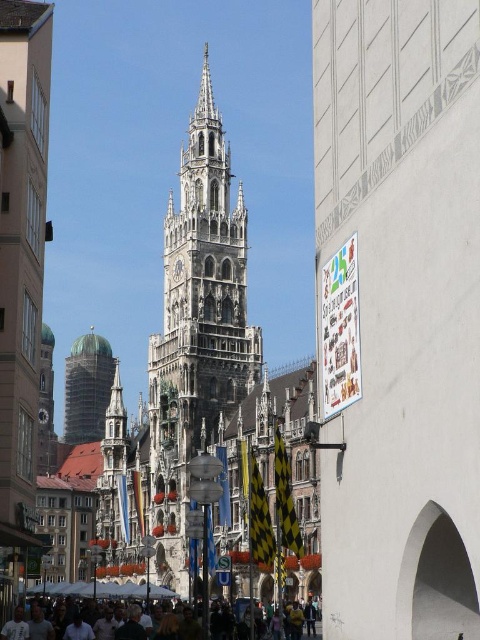
Question: Which is farther from the green copper dome at center?

Choices:
 (A) dark gray concrete crowd at lower center
 (B) stone gothic tower at center

Answer: (A)

Question: Which point is closer to the camera taking this photo?

Choices:
 (A) (72, 348)
 (B) (169, 612)

Answer: (B)

Question: Estimate the real-world distances between objects in this image. Which object is farther from the green copper dome at center?

Choices:
 (A) stone gothic tower at center
 (B) dark gray concrete crowd at lower center

Answer: (B)

Question: Is stone gothic tower at center thinner than dark gray concrete crowd at lower center?

Choices:
 (A) yes
 (B) no

Answer: (A)

Question: From the image, what is the correct spatial relationship of dark gray concrete crowd at lower center in relation to green copper dome at center?

Choices:
 (A) right
 (B) left

Answer: (A)

Question: Where is dark gray concrete crowd at lower center located in relation to green copper dome at center in the image?

Choices:
 (A) below
 (B) above

Answer: (A)